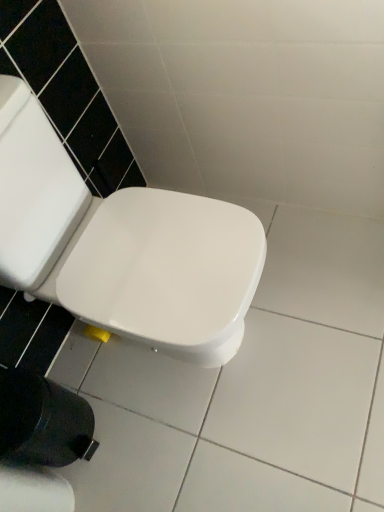
What do you see at coordinates (34, 490) in the screenshot? I see `white paper at lower left` at bounding box center [34, 490].

This screenshot has width=384, height=512. I want to click on white paper at lower left, so click(34, 490).

The height and width of the screenshot is (512, 384). In order to click on white glossy toilet seat at center in this screenshot , I will do `click(122, 246)`.

The image size is (384, 512). Describe the element at coordinates (122, 246) in the screenshot. I see `white glossy toilet seat at center` at that location.

Measure the distance between white glossy toilet seat at center and camera.

white glossy toilet seat at center is 32.19 inches from camera.

The image size is (384, 512). I want to click on white paper at lower left, so click(x=34, y=490).

Is white paper at lower left to the left or to the right of white glossy toilet seat at center in the image?

Based on their positions, white paper at lower left is located to the left of white glossy toilet seat at center.

Between white paper at lower left and white glossy toilet seat at center, which one is positioned in front?

white glossy toilet seat at center is in front.

Does point (41, 479) come in front of point (28, 273)?

That is False.

From the image's perspective, which one is positioned lower, white paper at lower left or white glossy toilet seat at center?

white paper at lower left appears lower in the image.

Based on the photo, from a real-world perspective, is white paper at lower left located higher than white glossy toilet seat at center?

Actually, white paper at lower left is physically below white glossy toilet seat at center in the real world.

In terms of width, does white paper at lower left look wider or thinner when compared to white glossy toilet seat at center?

white paper at lower left is thinner than white glossy toilet seat at center.

Is white paper at lower left shorter than white glossy toilet seat at center?

Yes.

Considering the relative sizes of white paper at lower left and white glossy toilet seat at center in the image provided, is white paper at lower left smaller than white glossy toilet seat at center?

Indeed, white paper at lower left has a smaller size compared to white glossy toilet seat at center.

Is white paper at lower left surrounding white glossy toilet seat at center?

No, white paper at lower left does not contain white glossy toilet seat at center.

Is white paper at lower left directly adjacent to white glossy toilet seat at center?

white paper at lower left and white glossy toilet seat at center are not in contact.

Is white paper at lower left facing towards white glossy toilet seat at center?

No, white paper at lower left is not oriented towards white glossy toilet seat at center.

How different are the orientations of white paper at lower left and white glossy toilet seat at center in degrees?

They differ by 0.576 degrees in their facing directions.

How distant is white paper at lower left from white glossy toilet seat at center?

A distance of 21.39 inches exists between white paper at lower left and white glossy toilet seat at center.

Locate an element on the screen. Image resolution: width=384 pixels, height=512 pixels. toilet paper that is on the left side of white glossy toilet seat at center is located at coordinates (34, 490).

Which is more to the right, white glossy toilet seat at center or white paper at lower left?

white glossy toilet seat at center.

Is white glossy toilet seat at center positioned in front of white paper at lower left?

Yes, it is.

Does point (178, 263) come closer to viewer compared to point (35, 487)?

Yes, point (178, 263) is in front of point (35, 487).

From the image's perspective, is white glossy toilet seat at center on white paper at lower left?

Yes, from the image's perspective, white glossy toilet seat at center is above white paper at lower left.

From a real-world perspective, is white glossy toilet seat at center beneath white paper at lower left?

No, from a real-world perspective, white glossy toilet seat at center is not below white paper at lower left.

Does white glossy toilet seat at center have a greater width compared to white paper at lower left?

Correct, the width of white glossy toilet seat at center exceeds that of white paper at lower left.

Who is taller, white glossy toilet seat at center or white paper at lower left?

white glossy toilet seat at center is taller.

Considering the sizes of objects white glossy toilet seat at center and white paper at lower left in the image provided, who is bigger, white glossy toilet seat at center or white paper at lower left?

white glossy toilet seat at center is bigger.

Is white glossy toilet seat at center inside or outside of white paper at lower left?

white glossy toilet seat at center is spatially situated outside white paper at lower left.

Is there a large distance between white glossy toilet seat at center and white paper at lower left?

No, white glossy toilet seat at center is not far away from white paper at lower left.

Is white glossy toilet seat at center oriented towards white paper at lower left?

No, white glossy toilet seat at center is not turned towards white paper at lower left.

This screenshot has width=384, height=512. In the image, there is a white paper at lower left. Identify the location of toilet above it (from the image's perspective). (122, 246).

Find the location of a particular element. The height and width of the screenshot is (512, 384). toilet above the white paper at lower left (from the image's perspective) is located at coordinates (122, 246).

In order to click on toilet paper to the left of white glossy toilet seat at center in this screenshot , I will do `click(34, 490)`.